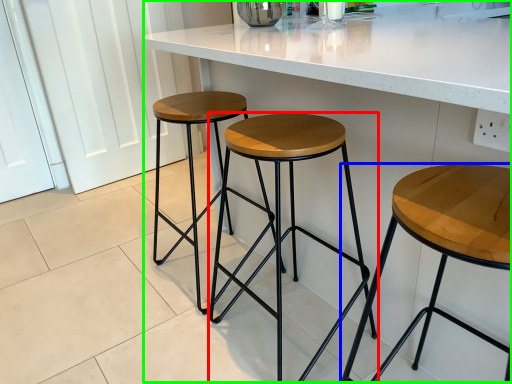
Question: Which is nearer to the stool (highlighted by a red box)? stool (highlighted by a blue box) or counter (highlighted by a green box).

Choices:
 (A) stool
 (B) counter

Answer: (B)